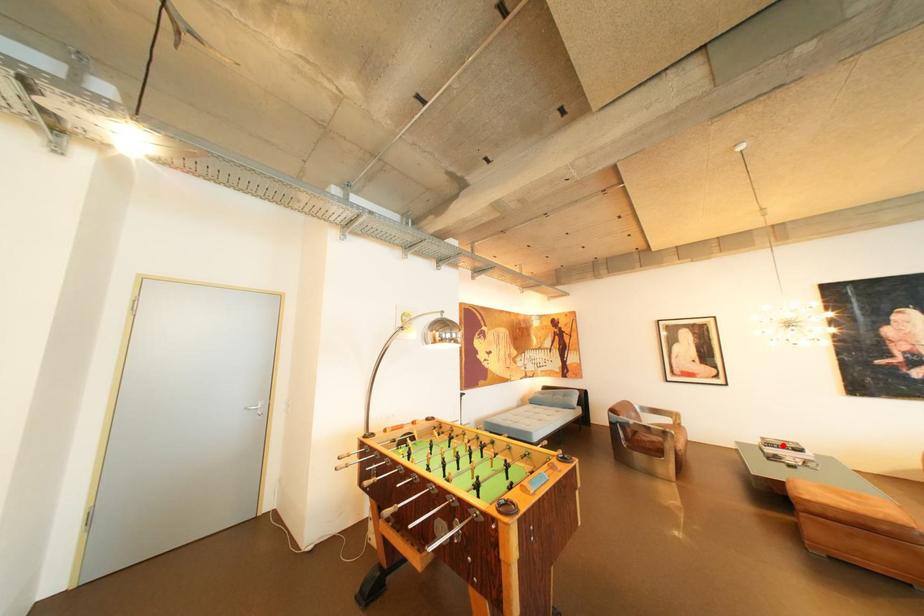
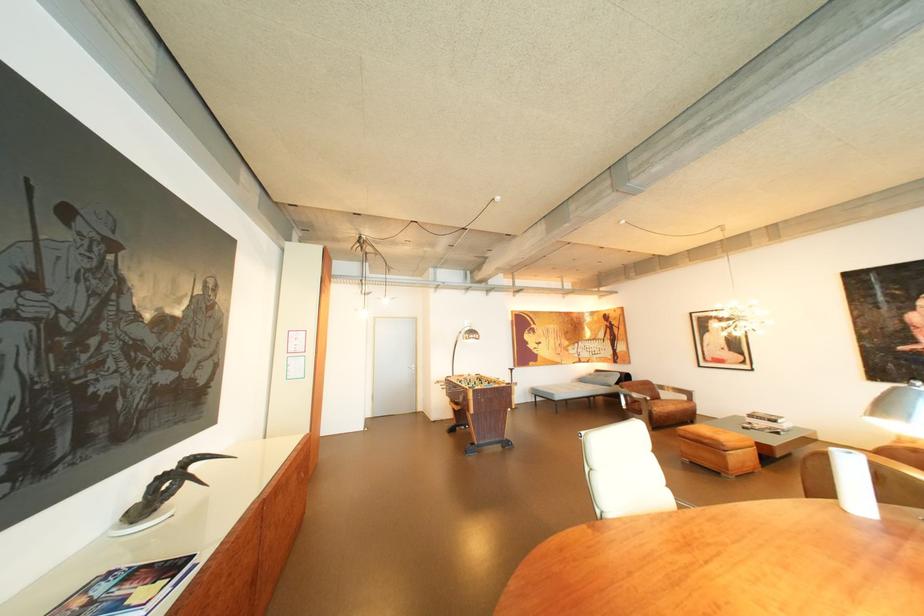
The point at the highlighted location is marked in the first image. Where is the corresponding point in the second image?

(763, 416)